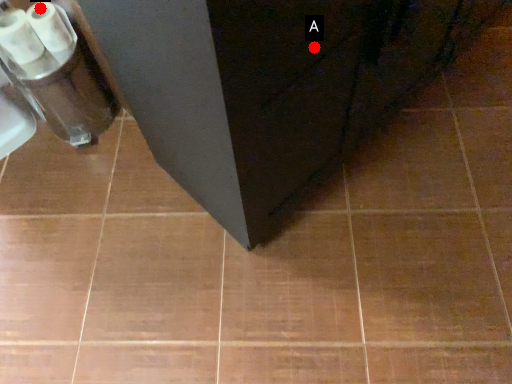
Question: Two points are circled on the image, labeled by A and B beside each circle. Which of the following is the farthest from the observer?

Choices:
 (A) A is further
 (B) B is further

Answer: (B)